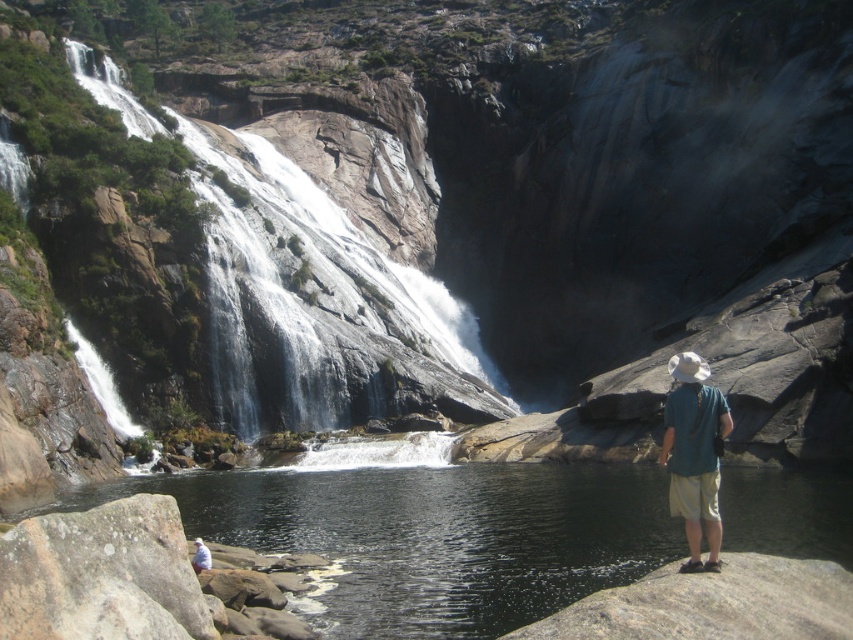
You are standing at the base of the waterfall and want to take a photo of both the point at coordinates point (x=183, y=474) and point (x=724, y=595). Which point should you focus on first to ensure both are in clear view?

You should focus on point (x=183, y=474) first because it is closer to the camera than point (x=724, y=595). By focusing on the closer point, the farther point will also be in focus due to the depth of field.

You are a hiker who wants to take a photo of both the green fabric shirt at lower right and the white cotton shirt at lower center in the scene. Which shirt should you focus on first to ensure both are in the frame?

You should focus on the white cotton shirt at lower center first because the green fabric shirt at lower right is to the right of it, so by centering the white cotton shirt at lower center, the green fabric shirt at lower right will naturally be included in the frame.